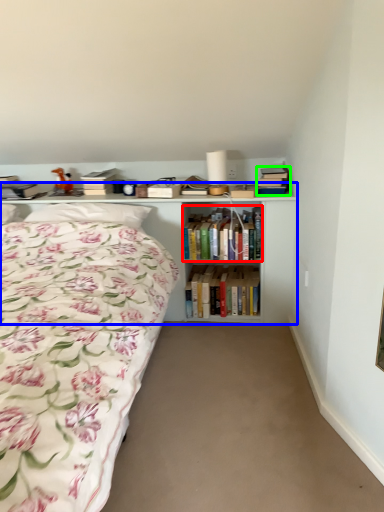
Question: Which object is positioned farthest from book (highlighted by a red box)? Select from shelf (highlighted by a blue box) and book (highlighted by a green box).

Choices:
 (A) shelf
 (B) book

Answer: (B)